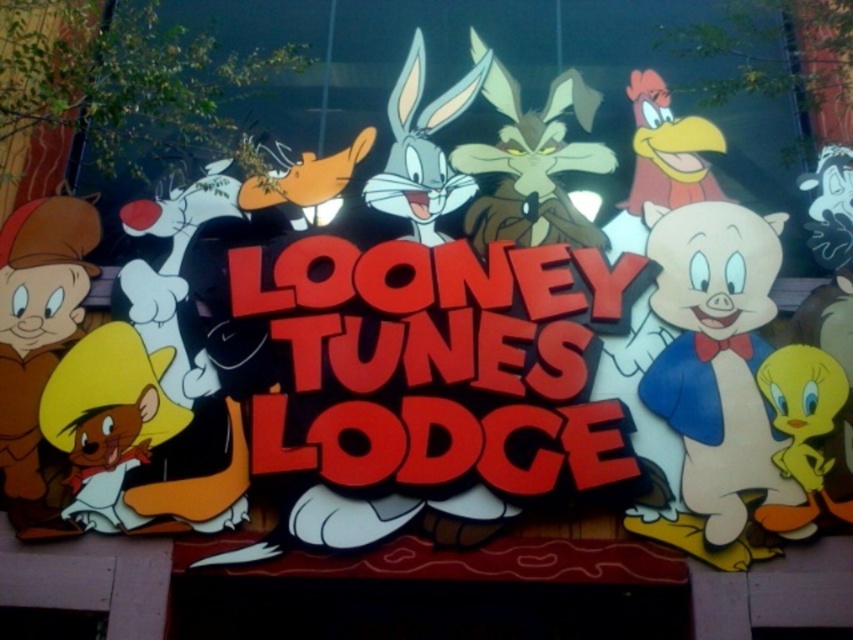
You are standing at the entrance of the Looney Tunes Lodge and want to take a photo of the sign. The sign is located at point (775, 440). If you need to be exactly 60 feet away to get the whole sign in the frame, will you be able to take the photo from your current position?

The distance between you and point (775, 440) is 60.40 feet. Since you need to be exactly 60 feet away, you are slightly too far to capture the entire sign in the frame.